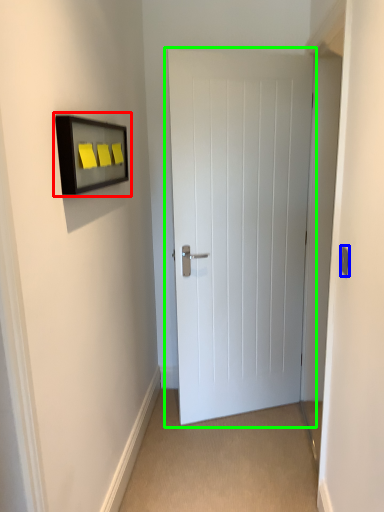
Question: Based on their relative distances, which object is nearer to medicine cabinet (highlighted by a red box)? Choose from light switch (highlighted by a blue box) and door (highlighted by a green box).

Choices:
 (A) light switch
 (B) door

Answer: (B)